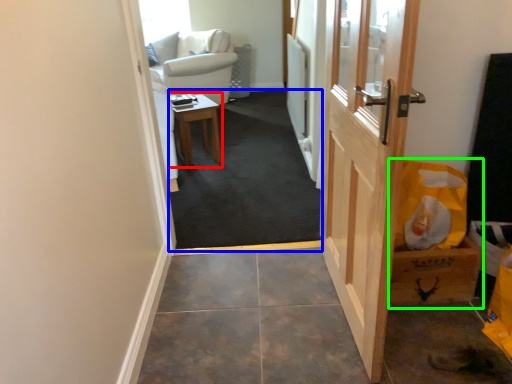
Question: Considering the real-world distances, which object is farthest from table (highlighted by a red box)? corridor (highlighted by a blue box) or cardboard box (highlighted by a green box)?

Choices:
 (A) corridor
 (B) cardboard box

Answer: (B)